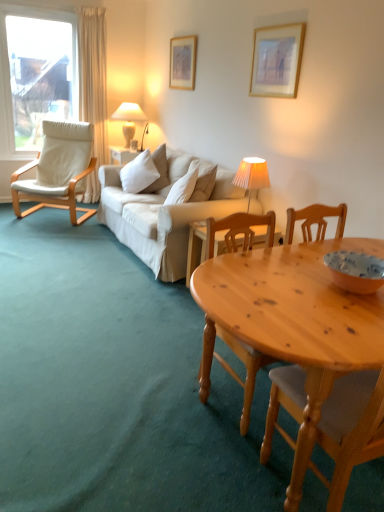
Question: Does white ceramic lamp at upper center, which appears as the second lamp when viewed from the right, come behind white soft cushion at center?

Choices:
 (A) yes
 (B) no

Answer: (A)

Question: Does white ceramic lamp at upper center, which is the 2th lamp in front-to-back order, have a greater height compared to white soft cushion at center?

Choices:
 (A) no
 (B) yes

Answer: (B)

Question: Is white ceramic lamp at upper center, positioned as the 1th lamp in back-to-front order, oriented towards white soft cushion at center?

Choices:
 (A) no
 (B) yes

Answer: (A)

Question: From the image's perspective, is white ceramic lamp at upper center, which appears as the second lamp when viewed from the right, located beneath white soft cushion at center?

Choices:
 (A) no
 (B) yes

Answer: (A)

Question: From a real-world perspective, does white ceramic lamp at upper center, positioned as the 1th lamp in back-to-front order, stand above white soft cushion at center?

Choices:
 (A) yes
 (B) no

Answer: (A)

Question: Does white ceramic lamp at upper center, which appears as the second lamp when viewed from the right, have a greater width compared to white soft cushion at center?

Choices:
 (A) no
 (B) yes

Answer: (A)

Question: From the image's perspective, is white ceramic lamp at upper center, positioned as the 1th lamp in back-to-front order, located beneath natural wood table at lower right?

Choices:
 (A) no
 (B) yes

Answer: (A)

Question: From a real-world perspective, is white ceramic lamp at upper center, the first lamp in the left-to-right sequence, on top of natural wood table at lower right?

Choices:
 (A) no
 (B) yes

Answer: (B)

Question: Is white ceramic lamp at upper center, which appears as the second lamp when viewed from the right, smaller than natural wood table at lower right?

Choices:
 (A) yes
 (B) no

Answer: (A)

Question: From a real-world perspective, is white ceramic lamp at upper center, placed as the first lamp when sorted from top to bottom, positioned under natural wood table at lower right based on gravity?

Choices:
 (A) yes
 (B) no

Answer: (B)

Question: Is white ceramic lamp at upper center, positioned as the 1th lamp in back-to-front order, positioned behind natural wood table at lower right?

Choices:
 (A) yes
 (B) no

Answer: (A)

Question: Does white ceramic lamp at upper center, the first lamp in the left-to-right sequence, turn towards natural wood table at lower right?

Choices:
 (A) yes
 (B) no

Answer: (B)

Question: From the image's perspective, is white pleated fabric lampshade at center, which is the 2th lamp from top to bottom, under wooden picture frame at upper center, marked as the 1th picture frame in a front-to-back arrangement?

Choices:
 (A) yes
 (B) no

Answer: (A)